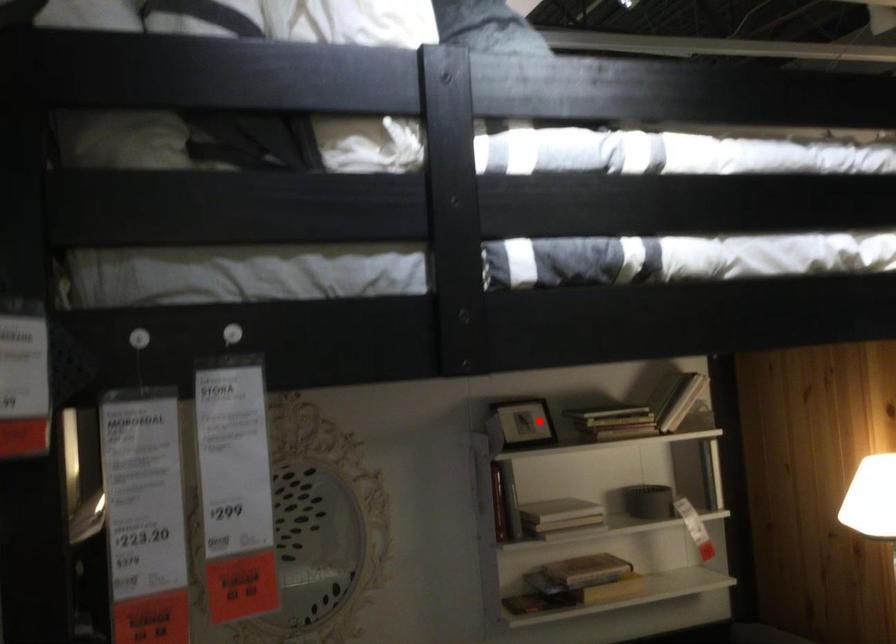
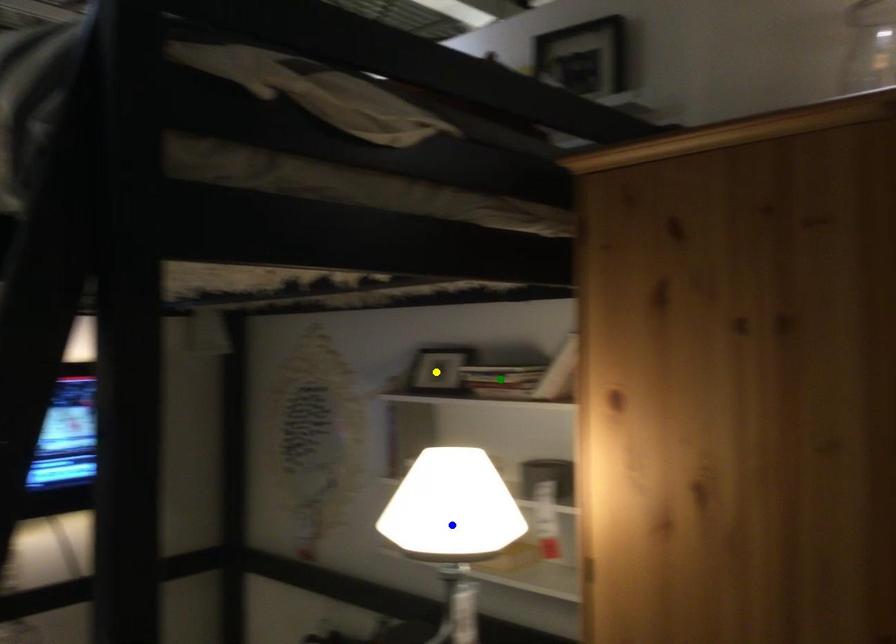
Question: I am providing you with two images of the same scene from different viewpoints. A red point is marked on the first image. You are given multiple points on the second image. Which spot in image 2 lines up with the point in image 1?

Choices:
 (A) yellow point
 (B) green point
 (C) blue point

Answer: (A)